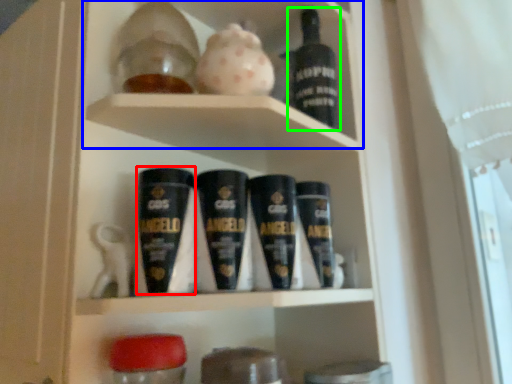
Question: Which object is positioned closest to shaving cream (highlighted by a red box)? Select from cabinet (highlighted by a blue box) and bottle (highlighted by a green box).

Choices:
 (A) cabinet
 (B) bottle

Answer: (A)